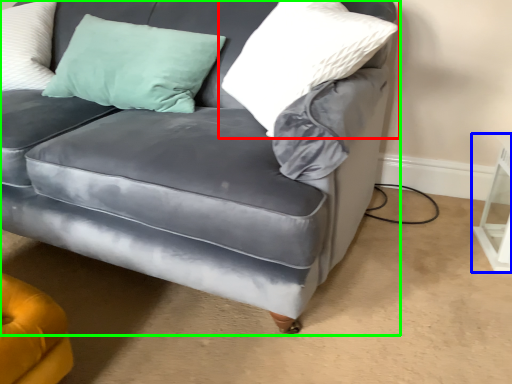
Question: Which object is positioned farthest from pillow (highlighted by a red box)? Select from table (highlighted by a blue box) and studio couch (highlighted by a green box).

Choices:
 (A) table
 (B) studio couch

Answer: (A)